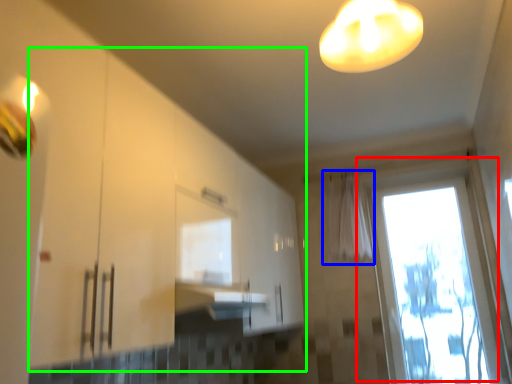
Question: Which is nearer to the window (highlighted by a red box)? curtain (highlighted by a blue box) or cabinetry (highlighted by a green box).

Choices:
 (A) curtain
 (B) cabinetry

Answer: (A)